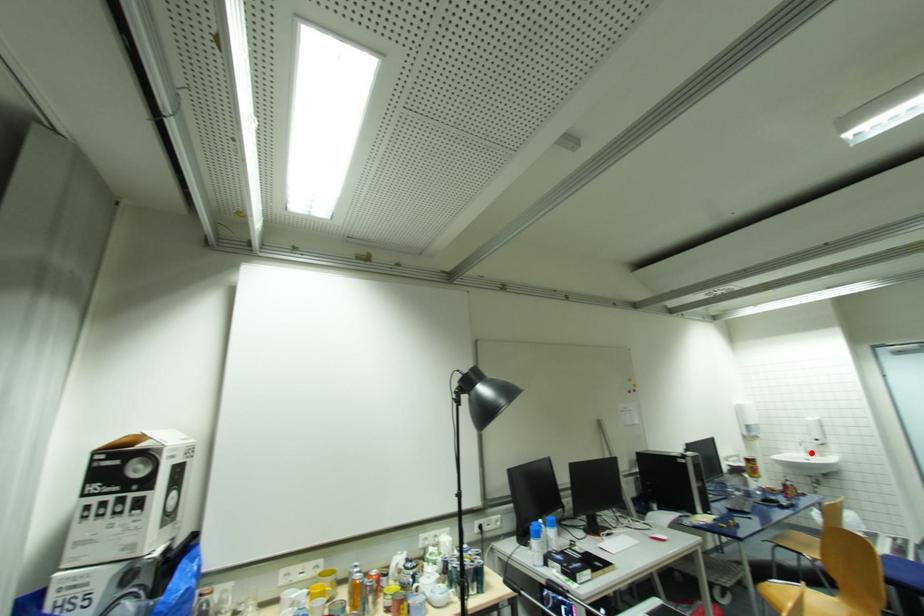
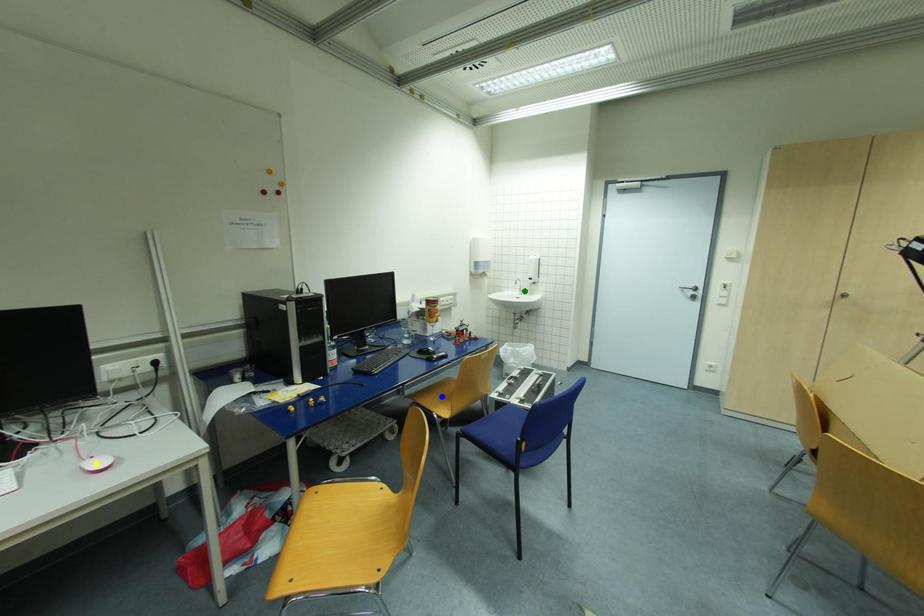
Question: I am providing you with two images of the same scene from different viewpoints. A red point is marked on the first image. You are given multiple points on the second image. Which point in image 2 represents the same 3d spot as the red point in image 1?

Choices:
 (A) green point
 (B) yellow point
 (C) blue point

Answer: (A)